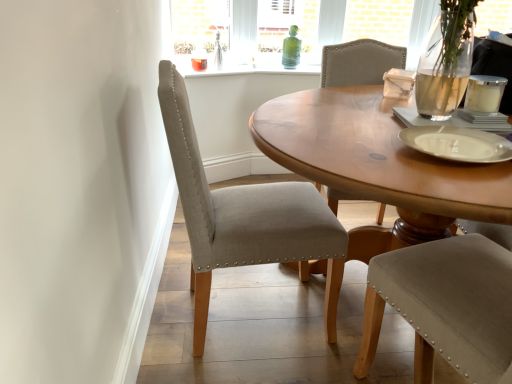
Question: Considering the relative sizes of beige fabric chair at center and white matte platter at right in the image provided, is beige fabric chair at center shorter than white matte platter at right?

Choices:
 (A) no
 (B) yes

Answer: (A)

Question: Is beige fabric chair at center outside white matte platter at right?

Choices:
 (A) no
 (B) yes

Answer: (B)

Question: From a real-world perspective, is beige fabric chair at center on top of white matte platter at right?

Choices:
 (A) yes
 (B) no

Answer: (B)

Question: From the image's perspective, does beige fabric chair at center appear higher than white matte platter at right?

Choices:
 (A) no
 (B) yes

Answer: (A)

Question: Is the depth of beige fabric chair at center less than that of white matte platter at right?

Choices:
 (A) yes
 (B) no

Answer: (B)

Question: Is white matte platter at right a part of beige fabric chair at center?

Choices:
 (A) no
 (B) yes

Answer: (A)

Question: Could you tell me if white matte platter at right is facing beige fabric chair at center?

Choices:
 (A) yes
 (B) no

Answer: (B)

Question: Is the position of white matte platter at right more distant than that of beige fabric chair at center?

Choices:
 (A) yes
 (B) no

Answer: (B)

Question: Considering the relative sizes of white matte platter at right and beige fabric chair at center in the image provided, is white matte platter at right shorter than beige fabric chair at center?

Choices:
 (A) no
 (B) yes

Answer: (B)

Question: Are white matte platter at right and beige fabric chair at center making contact?

Choices:
 (A) yes
 (B) no

Answer: (B)

Question: Considering the relative sizes of white matte platter at right and beige fabric chair at center in the image provided, is white matte platter at right taller than beige fabric chair at center?

Choices:
 (A) yes
 (B) no

Answer: (B)

Question: Does white matte platter at right have a larger size compared to beige fabric chair at center?

Choices:
 (A) yes
 (B) no

Answer: (B)

Question: Considering their positions, is beige fabric chair at center located in front of or behind white matte platter at right?

Choices:
 (A) behind
 (B) front

Answer: (A)